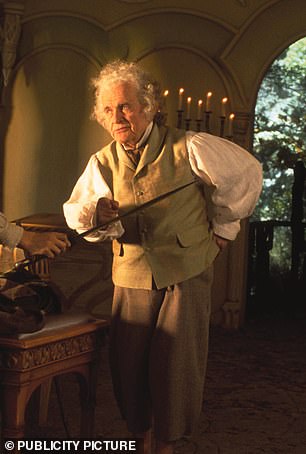
Where is `flame on lit candles`? flame on lit candles is located at coordinates (225, 98).